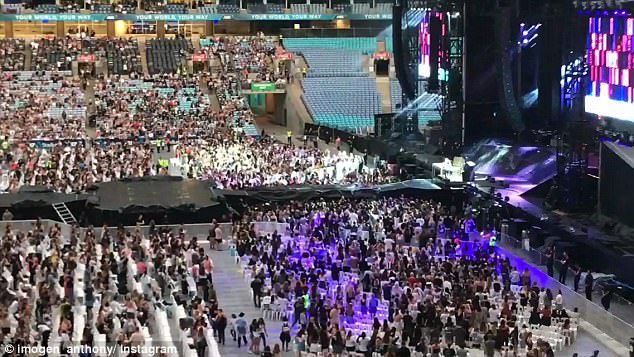
I want to click on stage, so click(x=496, y=170).